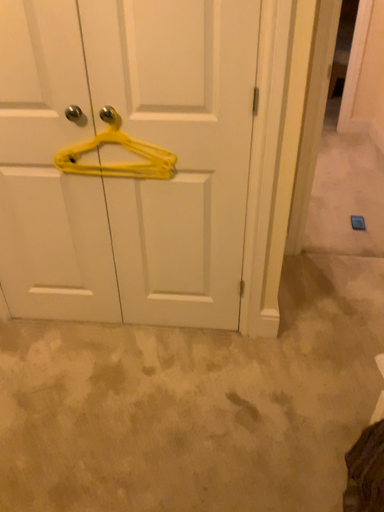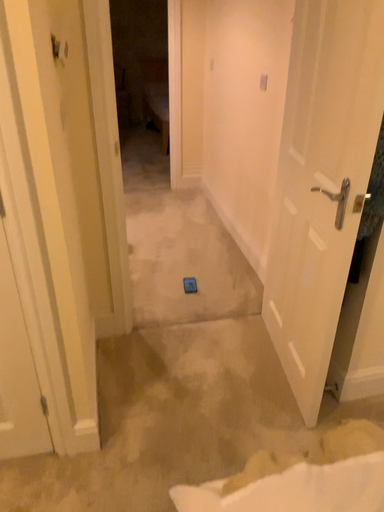
Question: Which way did the camera rotate in the video?

Choices:
 (A) rotated left
 (B) rotated right

Answer: (B)